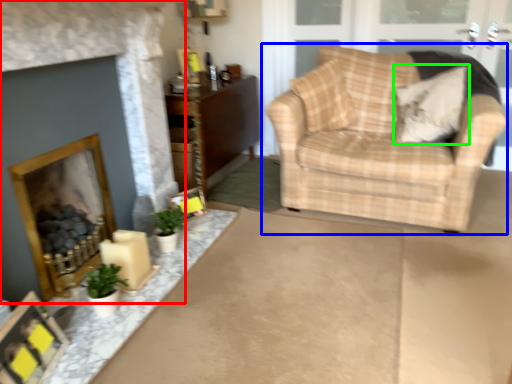
Question: Considering the real-world distances, which object is closest to fireplace (highlighted by a red box)? chair (highlighted by a blue box) or pillow (highlighted by a green box).

Choices:
 (A) chair
 (B) pillow

Answer: (A)